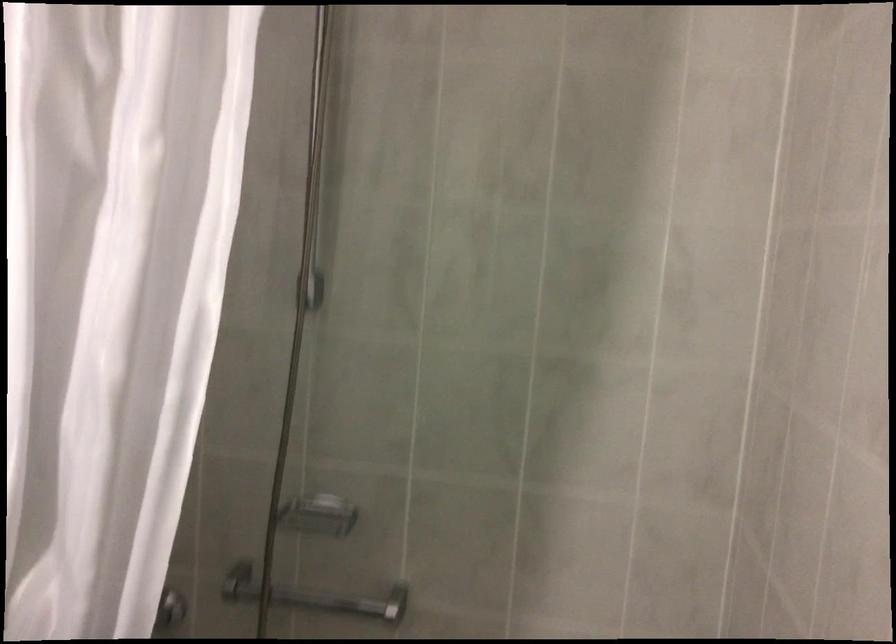
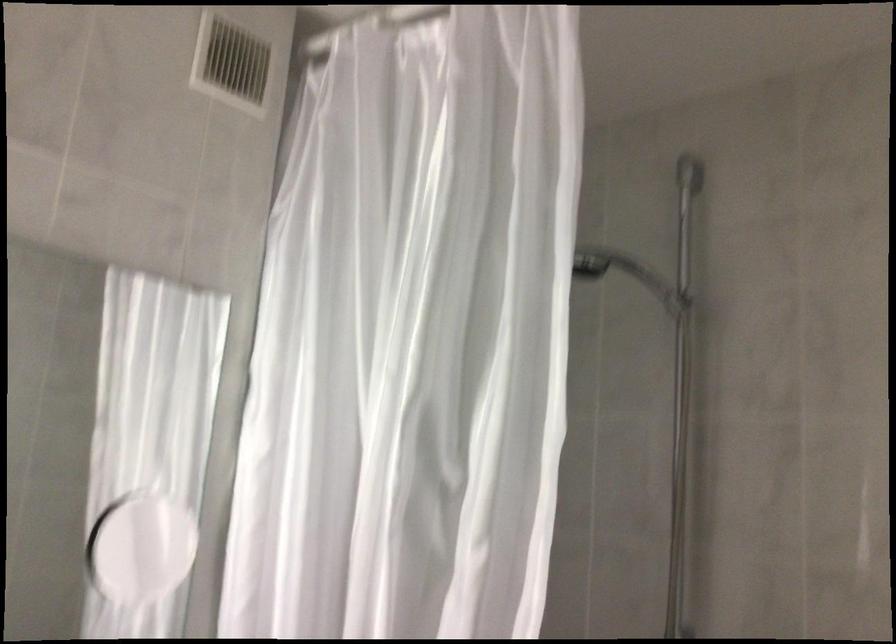
The first image is from the beginning of the video and the second image is from the end. How did the camera likely rotate when shooting the video?

The camera's rotation is toward left-up.